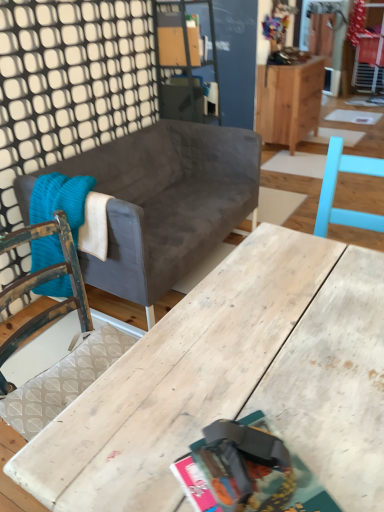
The image size is (384, 512). I want to click on blank space situated above wooden table at center (from a real-world perspective), so click(x=279, y=348).